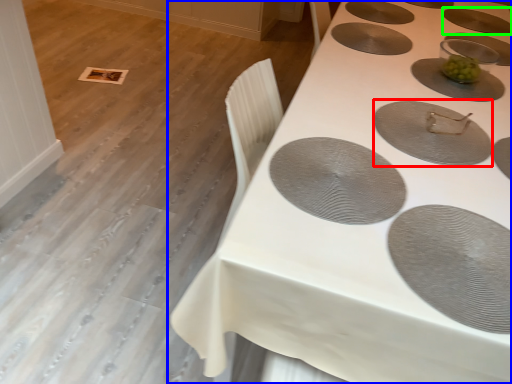
Question: Which is farther away from oval (highlighted by a red box)? table (highlighted by a blue box) or oval (highlighted by a green box)?

Choices:
 (A) table
 (B) oval

Answer: (B)